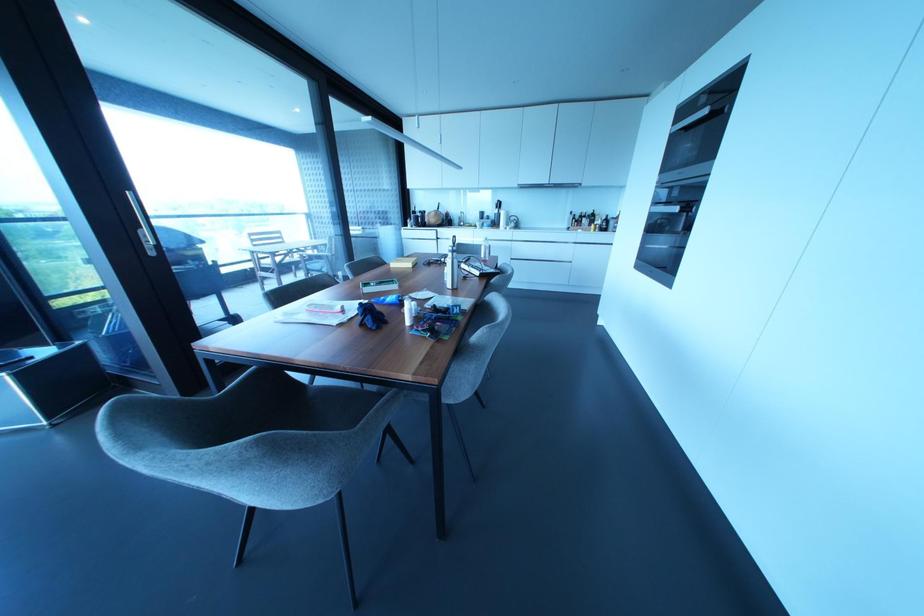
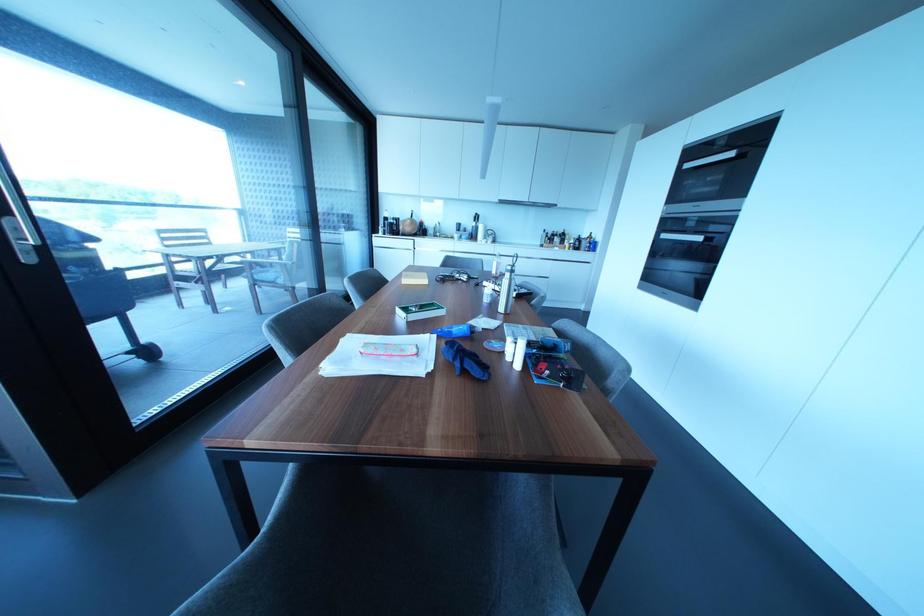
Question: How did the camera likely rotate?

Choices:
 (A) Left
 (B) Right
 (C) Up
 (D) Down

Answer: (B)